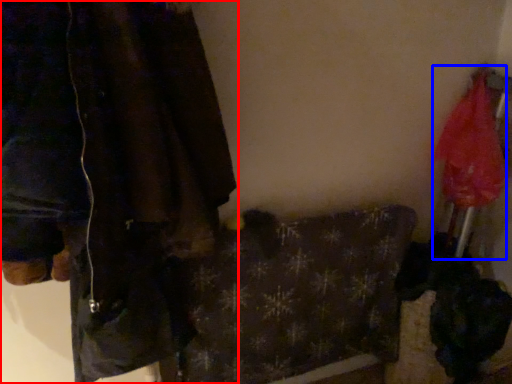
Question: Which of the following is the closest to the observer, jacket (highlighted by a red box) or umbrella (highlighted by a blue box)?

Choices:
 (A) jacket
 (B) umbrella

Answer: (A)